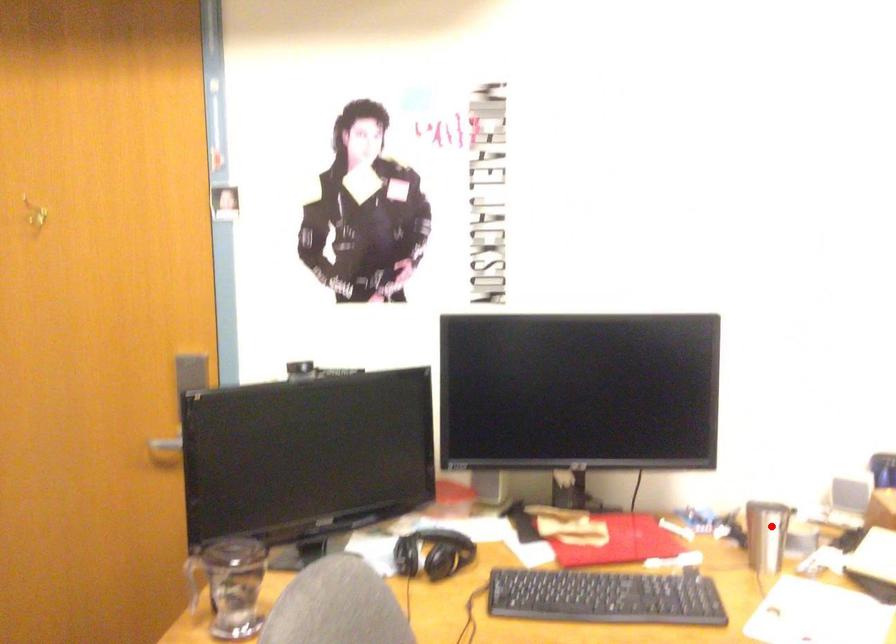
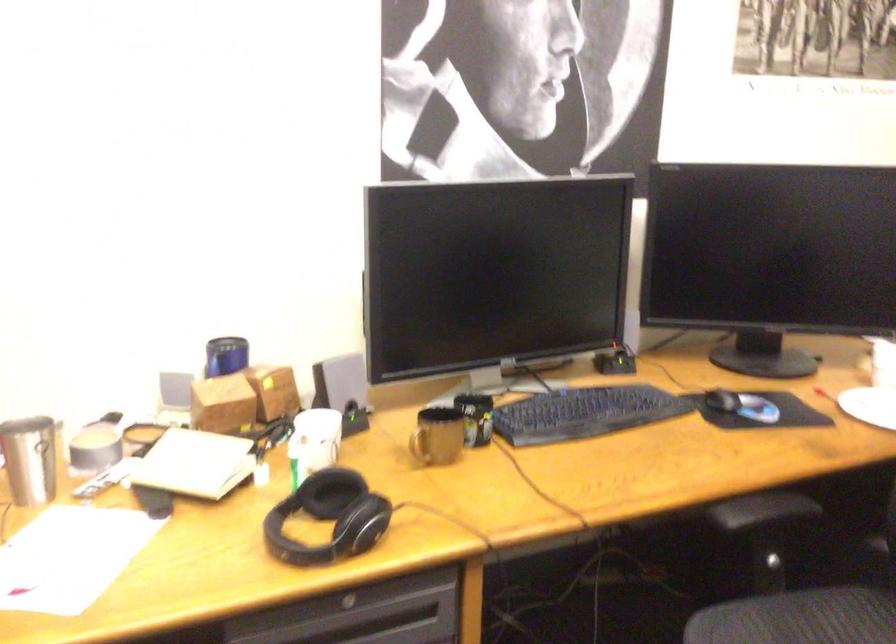
Where in the second image is the point corresponding to the highlighted location from the first image?

(30, 459)